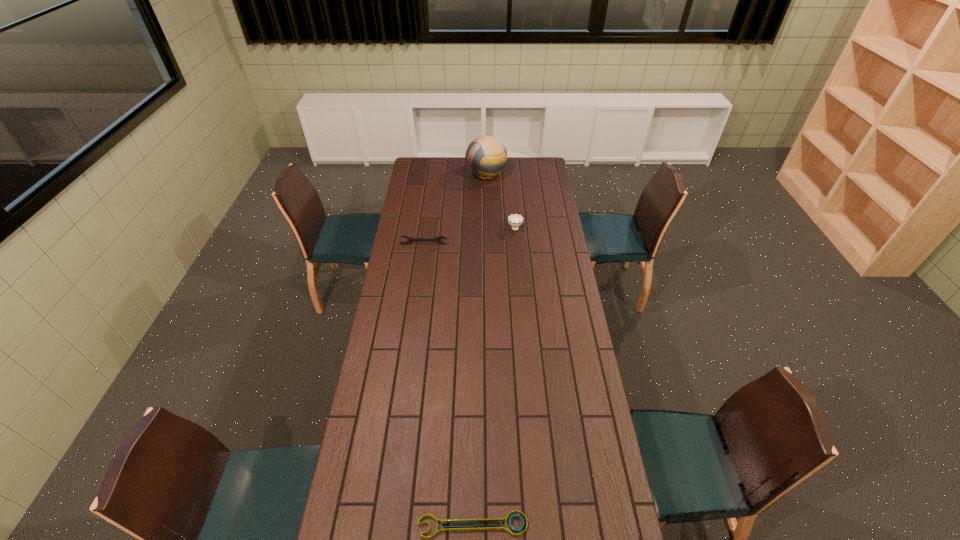
Image resolution: width=960 pixels, height=540 pixels. What are the coordinates of `the tallest object` in the screenshot? It's located at (486, 157).

Image resolution: width=960 pixels, height=540 pixels. What are the coordinates of `volleyball` in the screenshot? It's located at (486, 157).

Locate an element on the screen. the third shortest object is located at coordinates (515, 220).

Identify the location of cup. The width and height of the screenshot is (960, 540). (515, 220).

Identify the location of the taller wrench. The width and height of the screenshot is (960, 540). (438, 239).

Locate an element on the screen. The image size is (960, 540). the farther wrench is located at coordinates (438, 239).

Find the location of a particular element. Image resolution: width=960 pixels, height=540 pixels. the nearest object is located at coordinates (493, 520).

Image resolution: width=960 pixels, height=540 pixels. Identify the location of the nearer wrench. (493, 520).

I want to click on free space located on the front of the tallest object, so click(x=487, y=222).

The height and width of the screenshot is (540, 960). I want to click on free spot located on the side of the cup with the handle, so click(x=511, y=180).